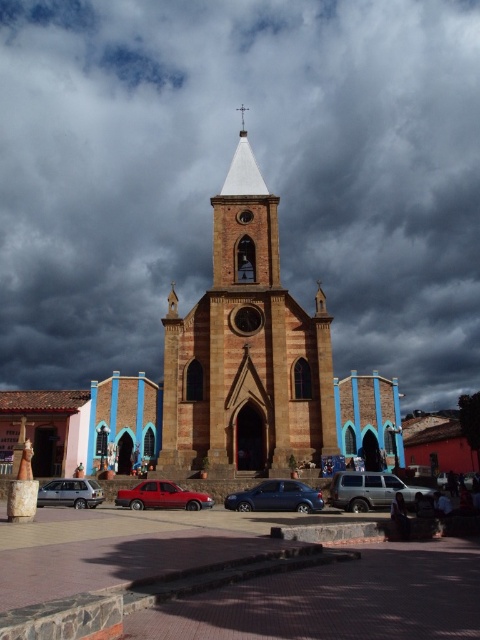
Who is lower down, dark cloudy sky at upper center or matte silver suv at lower left?

matte silver suv at lower left is below.

At what (x,y) coordinates should I click in order to perform the action: click on dark cloudy sky at upper center. Please return your answer as a coordinate pair (x, y). The width and height of the screenshot is (480, 640). Looking at the image, I should click on (226, 172).

Image resolution: width=480 pixels, height=640 pixels. I want to click on dark cloudy sky at upper center, so click(x=226, y=172).

Between brick pavement at center and silver metallic suv at center, which one is positioned higher?

silver metallic suv at center is above.

Can you confirm if brick pavement at center is shorter than silver metallic suv at center?

No.

Which is in front, point (410, 560) or point (348, 509)?

Point (410, 560) is in front.

At what (x,y) coordinates should I click in order to perform the action: click on brick pavement at center. Please return your answer as a coordinate pair (x, y). Looking at the image, I should click on (227, 579).

Can you confirm if brown stone tower at center is positioned above metallic blue car at center?

Indeed, brown stone tower at center is positioned over metallic blue car at center.

What do you see at coordinates (245, 349) in the screenshot? The height and width of the screenshot is (640, 480). I see `brown stone tower at center` at bounding box center [245, 349].

Where is `brown stone tower at center`? brown stone tower at center is located at coordinates (245, 349).